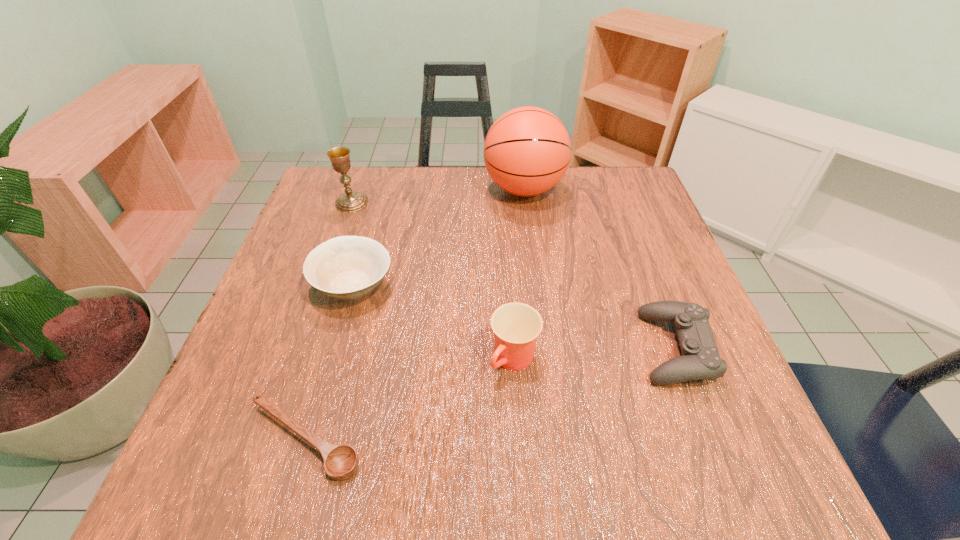
The height and width of the screenshot is (540, 960). Identify the location of free point between the third tallest object and the fifth tallest object. (594, 354).

Locate an element on the screen. The image size is (960, 540). unoccupied position between the bowl and the tallest object is located at coordinates [x=439, y=238].

Where is `vacant space in between the nearest object and the rightmost object`? This screenshot has height=540, width=960. vacant space in between the nearest object and the rightmost object is located at coordinates [x=490, y=394].

You are a GUI agent. You are given a task and a screenshot of the screen. Output one action in this format:
    pyautogui.click(x=<x>, y=<y>)
    Task: Click on the vacant point located between the fifth shortest object and the cup
    The width and height of the screenshot is (960, 540).
    Given the screenshot: What is the action you would take?
    pyautogui.click(x=433, y=281)

Where is `free space between the rightmost object and the wooden spoon`? free space between the rightmost object and the wooden spoon is located at coordinates (490, 394).

This screenshot has height=540, width=960. In order to click on empty location between the control and the nearest object in this screenshot , I will do `click(490, 394)`.

Locate an element on the screen. This screenshot has height=540, width=960. free point between the rightmost object and the wooden spoon is located at coordinates (490, 394).

I want to click on unoccupied position between the cup and the tallest object, so 519,274.

Image resolution: width=960 pixels, height=540 pixels. Identify the location of vacant space in between the tallest object and the shortest object. click(x=415, y=314).

Identify the location of unoccupied area between the basketball and the third tallest object. The image size is (960, 540). (519, 274).